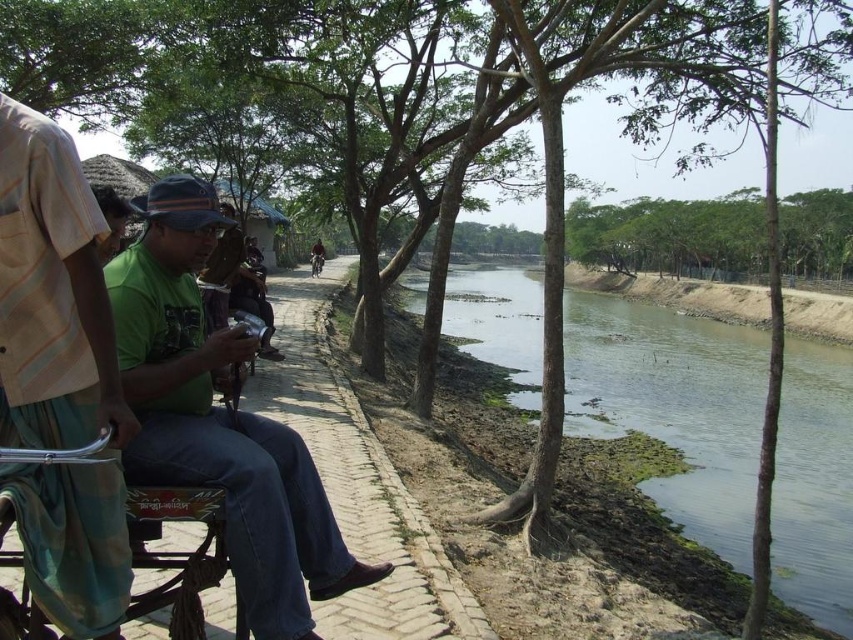
You are a photographer standing on the riverside pathway. You want to take a photo of both the green matte shirt at center and the dark brown leather jacket at center. Which one should you focus on first if you want to capture them both clearly in the same frame?

The green matte shirt at center is positioned on the right side of dark brown leather jacket at center. Therefore, you should focus on the dark brown leather jacket at center first, as it is closer to the left side and adjusting focus from left to right will ensure both are in frame.